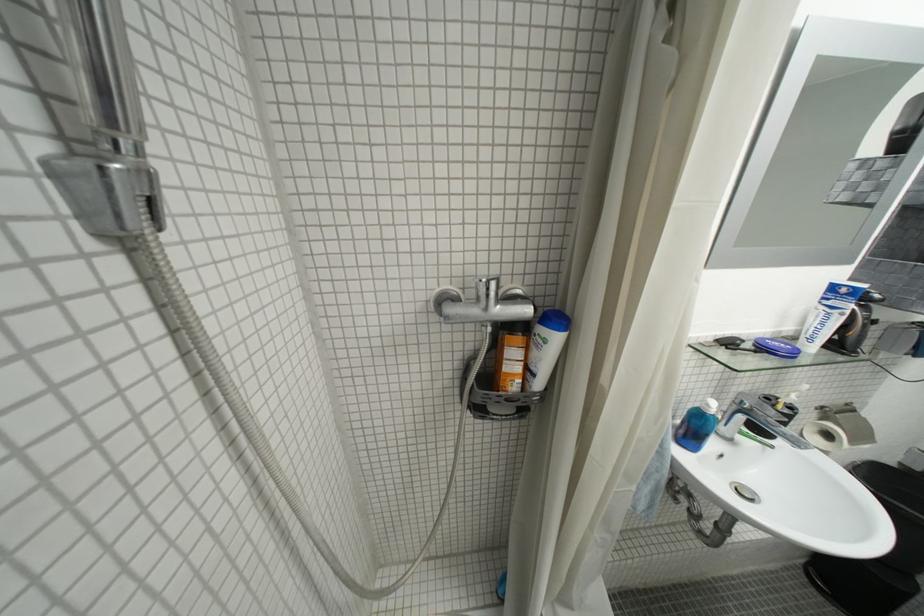
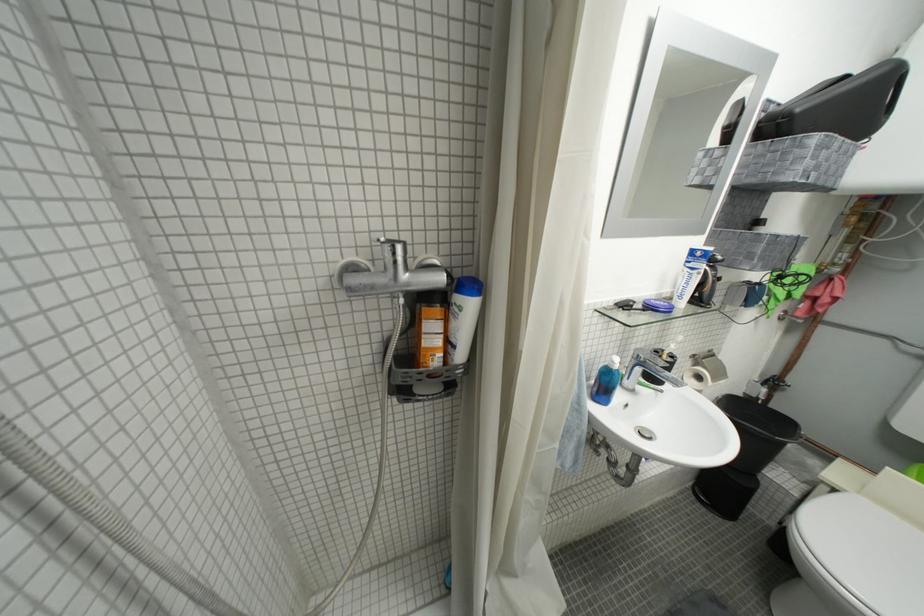
Question: The first image is from the beginning of the video and the second image is from the end. How did the camera likely rotate when shooting the video?

Choices:
 (A) Left
 (B) Right
 (C) Up
 (D) Down

Answer: (B)